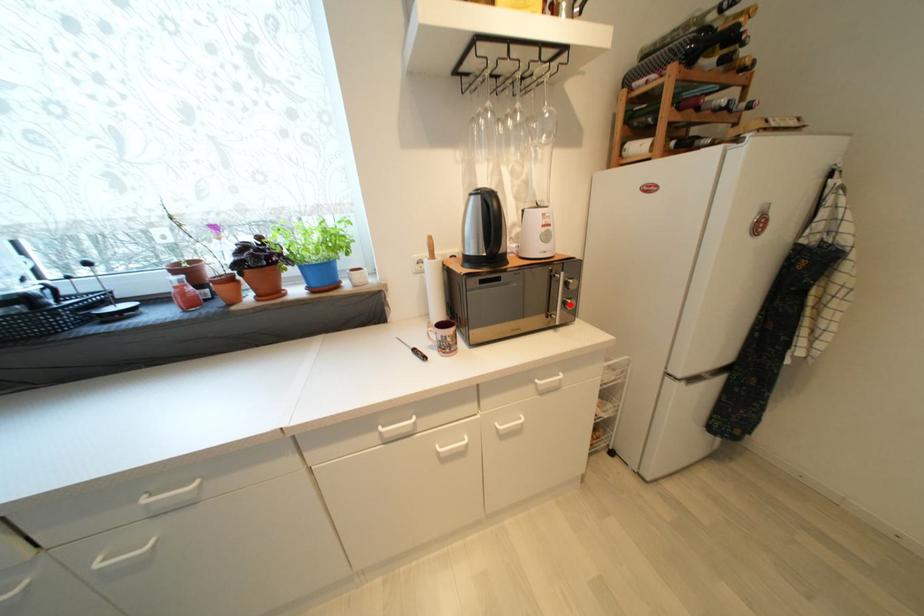
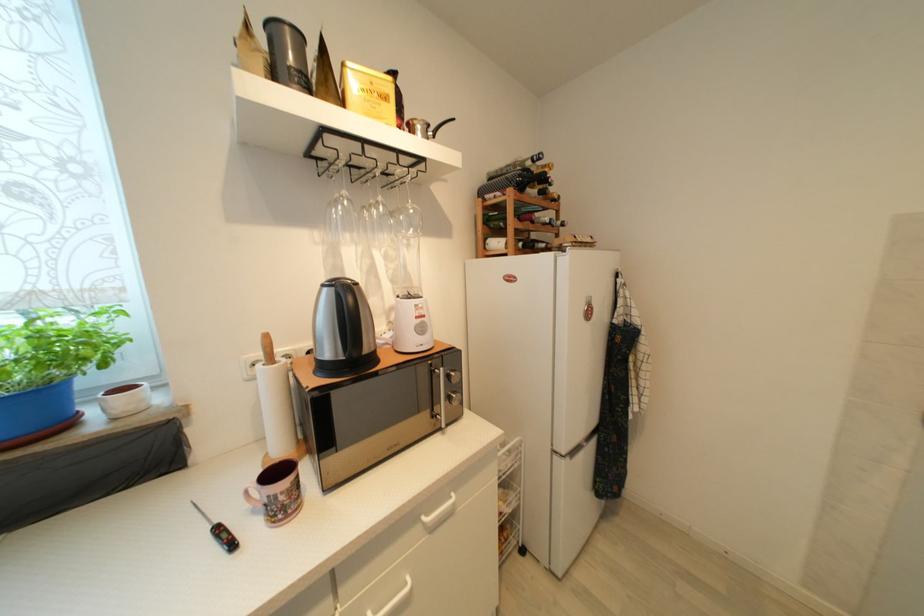
Question: I am providing you with two images of the same scene from different viewpoints. A red point is marked on the first image. Is the red point's position out of view in image 2?

Choices:
 (A) Yes
 (B) No

Answer: (B)